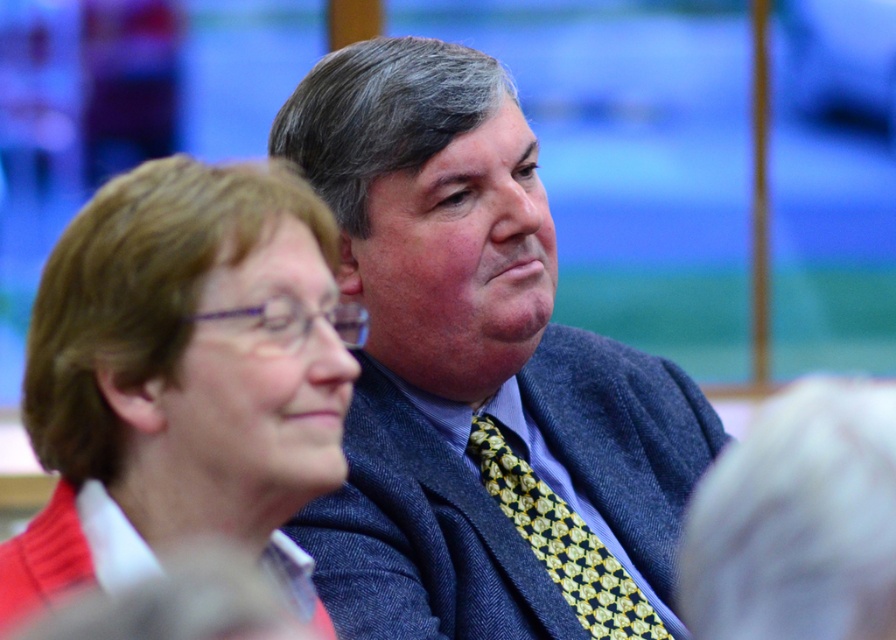
You are a photographer standing at the camera position. You want to adjust your focus to capture a sharp image of the point at coordinates point (558, 577). Given that your camera can focus on objects within 10 feet, will the point be in focus?

The distance of point (558, 577) from the camera is 9.69 feet, which is within the camera focus range of 10 feet. Therefore, the point will be in focus.